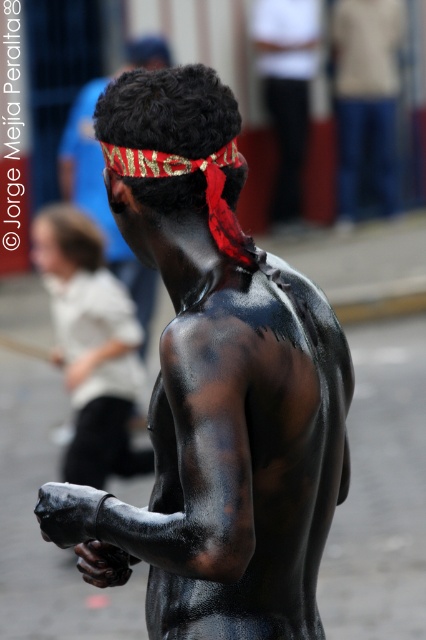
Question: In this image, where is black matte skin at center located relative to blue jeans at center?

Choices:
 (A) left
 (B) right

Answer: (A)

Question: Is blue jeans at center to the left of black matte headband at upper center from the viewer's perspective?

Choices:
 (A) yes
 (B) no

Answer: (B)

Question: Which of the following is the farthest from the observer?

Choices:
 (A) blue jeans at center
 (B) shiny black skin at center

Answer: (A)

Question: Which is nearer to the shiny black skin at center?

Choices:
 (A) blue jeans at center
 (B) black matte headband at upper center
 (C) black matte skin at center

Answer: (B)

Question: Does black matte skin at center lie behind shiny black skin at center?

Choices:
 (A) no
 (B) yes

Answer: (A)

Question: Which point is farther from the camera taking this photo?

Choices:
 (A) coord(94,184)
 (B) coord(294,10)
 (C) coord(340,76)

Answer: (C)